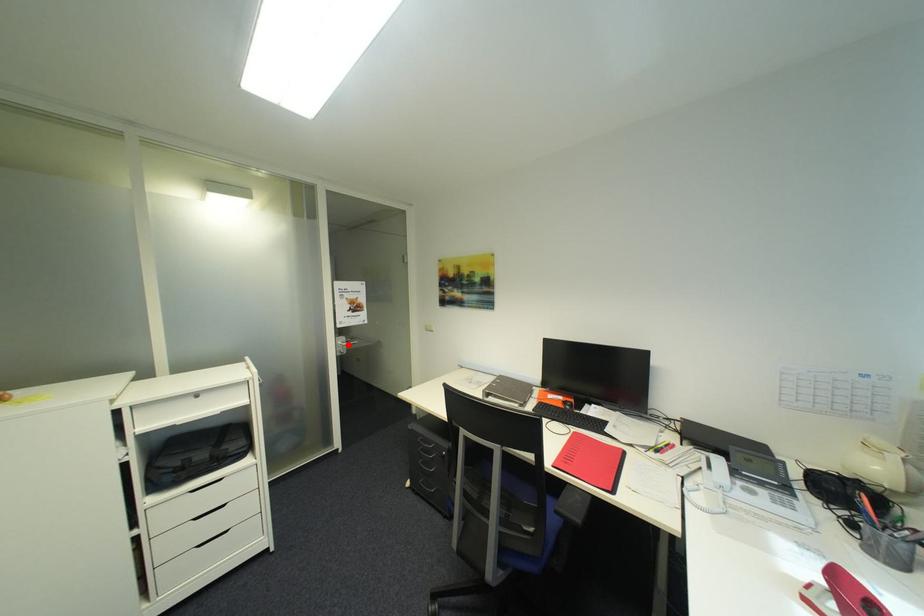
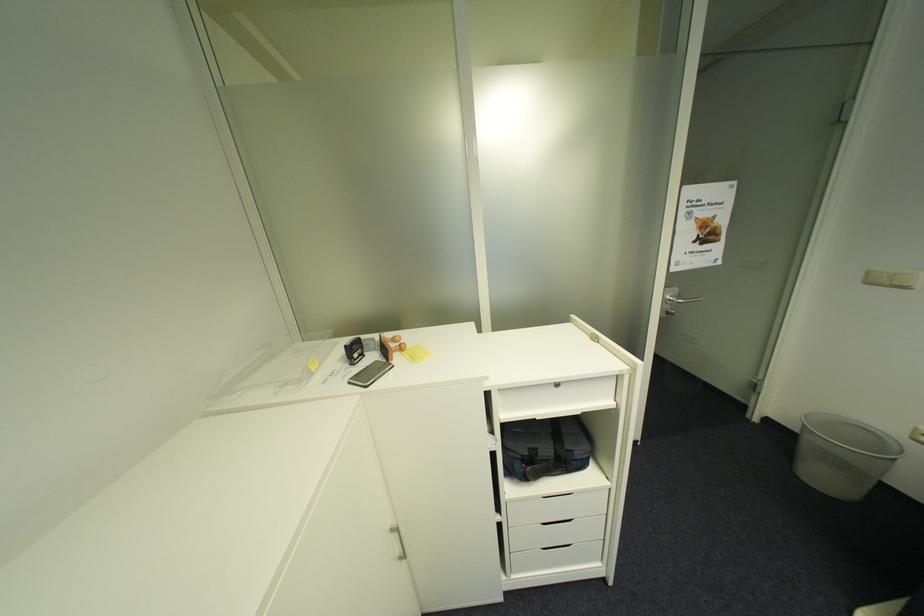
Question: A red point is marked in image1. In image2, is the corresponding 3D point closer to the camera or farther? Reply with the corresponding letter.

Choices:
 (A) The corresponding 3D point is closer.
 (B) The corresponding 3D point is farther.

Answer: (B)